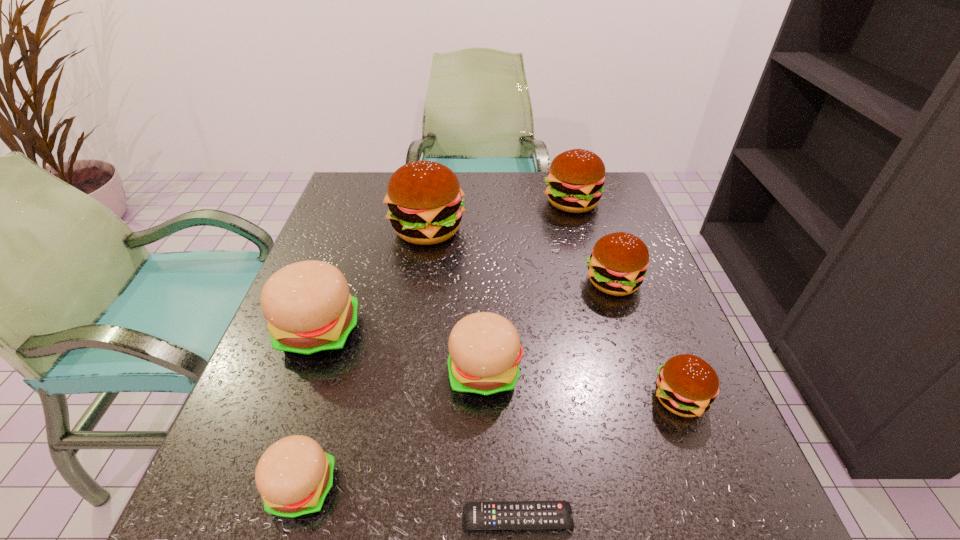
This screenshot has width=960, height=540. I want to click on the biggest brown hamburger, so click(425, 202).

Find the location of `the tallest hamburger`. the tallest hamburger is located at coordinates (425, 202).

Locate an element on the screen. This screenshot has height=540, width=960. the third smallest brown hamburger is located at coordinates (575, 181).

I want to click on the biggest beige hamburger, so tap(310, 312).

The width and height of the screenshot is (960, 540). I want to click on the third biggest brown hamburger, so click(618, 263).

This screenshot has height=540, width=960. In order to click on the third farthest hamburger in this screenshot , I will do `click(618, 263)`.

Locate an element on the screen. Image resolution: width=960 pixels, height=540 pixels. the rightmost beige hamburger is located at coordinates (484, 348).

This screenshot has width=960, height=540. I want to click on the smallest brown hamburger, so click(x=686, y=385).

The image size is (960, 540). I want to click on the smallest beige hamburger, so click(x=294, y=476).

The width and height of the screenshot is (960, 540). I want to click on the nearest beige hamburger, so coord(294,476).